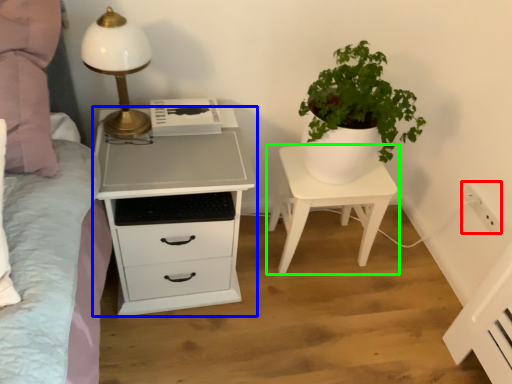
Question: Which object is the closest to the electric outlet (highlighted by a red box)? Choose among these: chest of drawers (highlighted by a blue box) or nightstand (highlighted by a green box).

Choices:
 (A) chest of drawers
 (B) nightstand

Answer: (B)